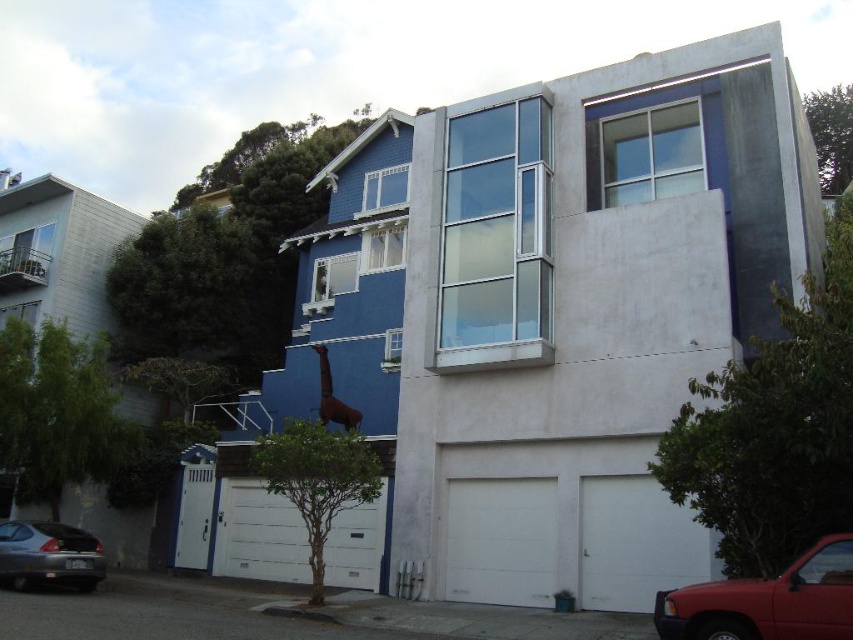
You are standing at the entrance of the building and want to walk directly towards the green leafy tree at right. Which direction should you move relative to your current position?

The green leafy tree at right is located at coordinates 0.669 on the x axis and 0.909 on the y axis, so you should move towards the right and slightly forward to reach it.

You are a delivery person trying to park your delivery van which is 6 meters long. You see the green leafy tree at right and the metallic gray sedan at lower left in the parking area. Which parking spot has enough space for your van?

The parking spot near the green leafy tree at right has enough space for your van since the tree is larger than the metallic gray sedan at lower left, implying a wider parking area.